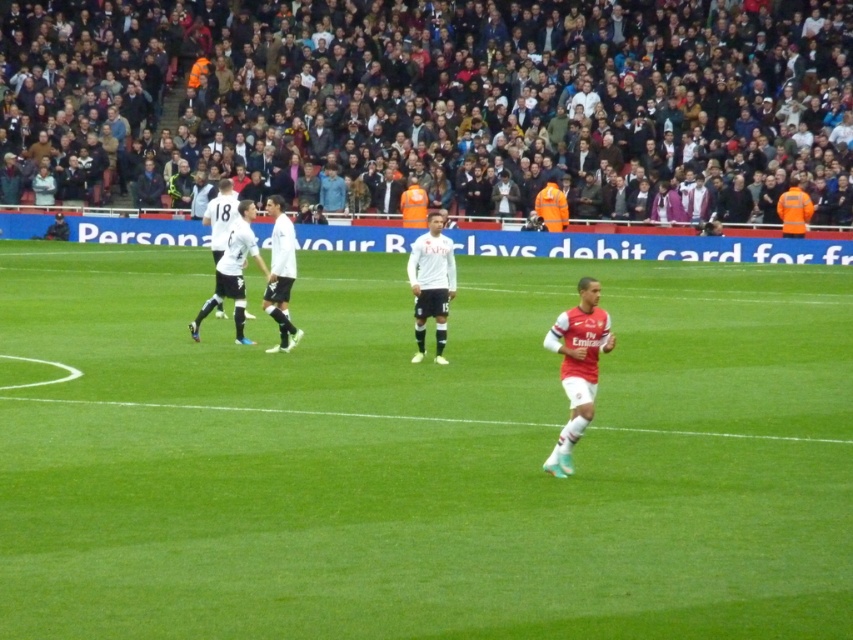
Question: Does green grass field at center lie in front of white jersey at center?

Choices:
 (A) no
 (B) yes

Answer: (B)

Question: Which of the following is the farthest from the observer?

Choices:
 (A) green grass field at center
 (B) dark gray crowd at upper center
 (C) white matte soccer player at center
 (D) white matte jersey at center

Answer: (B)

Question: Which point appears closest to the camera in this image?

Choices:
 (A) (236, 310)
 (B) (815, 320)

Answer: (A)

Question: In this image, where is white jersey at center located relative to matte red jersey at right?

Choices:
 (A) above
 (B) below

Answer: (A)

Question: Is the position of white jersey at center more distant than that of white smooth jersey at center?

Choices:
 (A) no
 (B) yes

Answer: (A)

Question: Which object is the farthest from the dark gray crowd at upper center?

Choices:
 (A) matte red jersey at right
 (B) white smooth jersey at center

Answer: (A)